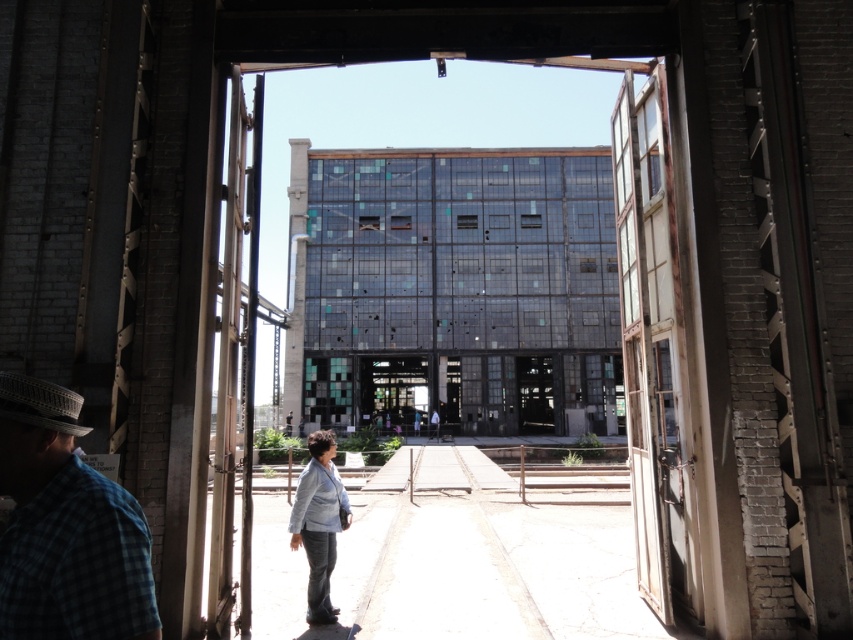
Question: Which of the following is the farthest from the observer?

Choices:
 (A) white woven fedora at left
 (B) blue plaid shirt at lower left

Answer: (A)

Question: Does blue plaid shirt at lower left appear under white woven fedora at left?

Choices:
 (A) yes
 (B) no

Answer: (A)

Question: Which point is closer to the camera taking this photo?

Choices:
 (A) (59, 416)
 (B) (22, 396)

Answer: (B)

Question: Is blue plaid shirt at lower left wider than white woven fedora at left?

Choices:
 (A) yes
 (B) no

Answer: (A)

Question: Does blue plaid shirt at lower left have a lesser width compared to white woven fedora at left?

Choices:
 (A) no
 (B) yes

Answer: (A)